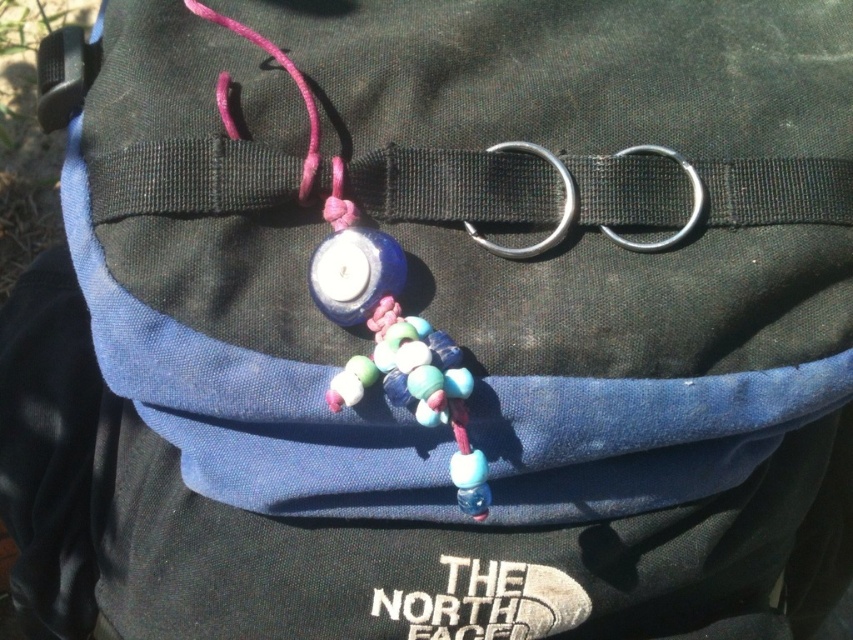
Is black fabric strap at center bigger than matte blue bead at center?

Indeed, black fabric strap at center has a larger size compared to matte blue bead at center.

Can you confirm if black fabric strap at center is positioned to the left of matte blue bead at center?

Incorrect, black fabric strap at center is not on the left side of matte blue bead at center.

Identify the location of black fabric strap at center. The height and width of the screenshot is (640, 853). click(x=738, y=124).